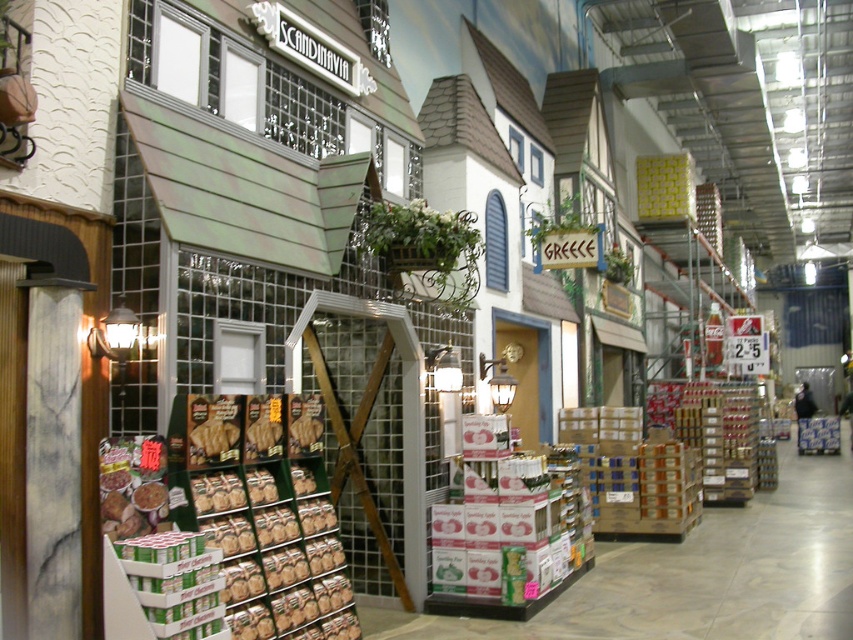
Question: Which point appears closest to the camera in this image?

Choices:
 (A) (196, 426)
 (B) (289, 444)

Answer: (A)

Question: Which of these objects is positioned closest to the brown matte cookies at center?

Choices:
 (A) brown crumbly bread at center
 (B) green cardboard boxes at center
 (C) matte brown bread at center

Answer: (A)

Question: Which of the following is the farthest from the observer?

Choices:
 (A) brown crumbly bread at center
 (B) brown matte cookies at center
 (C) green cardboard boxes at center

Answer: (A)

Question: Can you confirm if matte brown bread at center is positioned above brown crumbly bread at center?

Choices:
 (A) no
 (B) yes

Answer: (A)

Question: Is matte brown bread at center to the right of brown matte cookies at center from the viewer's perspective?

Choices:
 (A) no
 (B) yes

Answer: (B)

Question: Is green cardboard boxes at center positioned behind brown matte cookies at center?

Choices:
 (A) yes
 (B) no

Answer: (B)